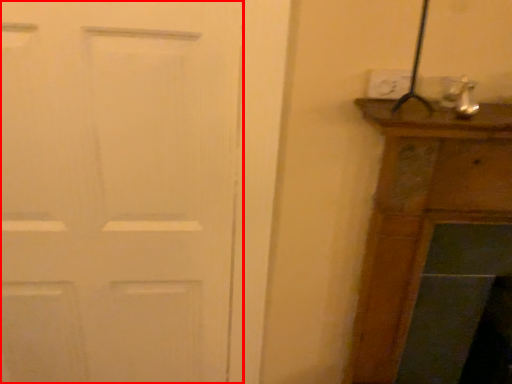
Question: Where is door (annotated by the red box) located in relation to electric outlet in the image?

Choices:
 (A) left
 (B) right

Answer: (A)